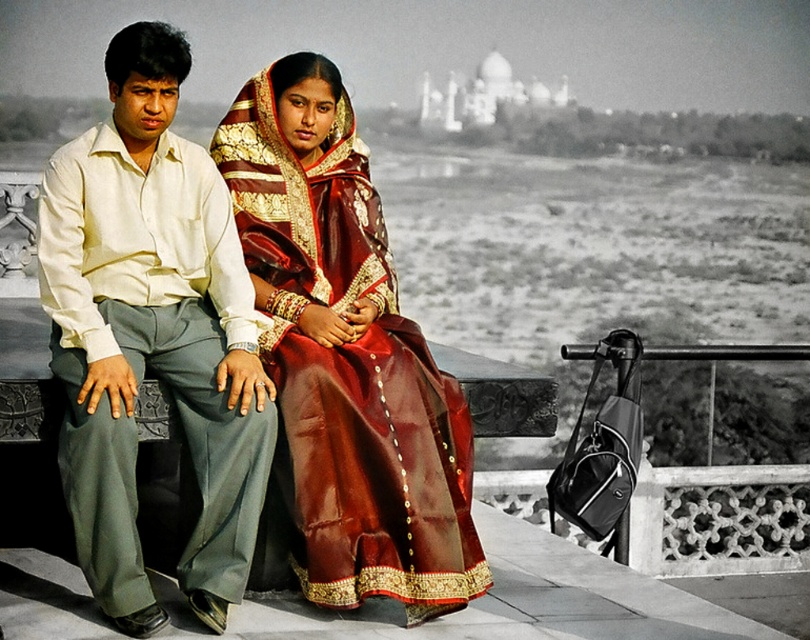
You are standing in front of the two people sitting on the stone bench. You want to throw a small ball to the person on the left without it going past them. Which point, point (178, 576) or point (335, 257), should you aim for to ensure the ball stops near them?

You should aim for point (178, 576) because it is closer to the viewer than point (335, 257), so it will land near the person on the left without going past them.

You are a photographer setting up for a group photo. You notice the light beige cotton shirt at left and the shiny silk saree at center in your frame. Which clothing item should you adjust to ensure both are clearly visible without one blocking the other?

The light beige cotton shirt at left is in front of the shiny silk saree at center. To ensure both are clearly visible, you should adjust the light beige cotton shirt at left to move it out of the way so the shiny silk saree at center is not blocked.